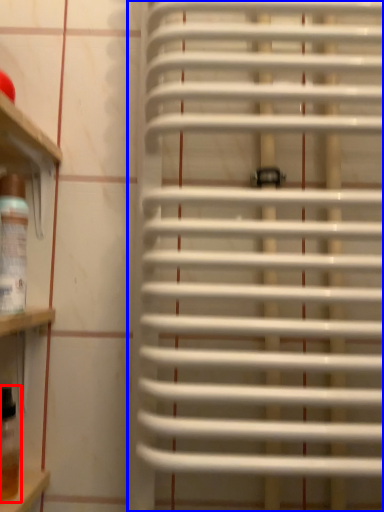
Question: Which object appears farthest to the camera in this image, wine bottle (highlighted by a red box) or window blind (highlighted by a blue box)?

Choices:
 (A) wine bottle
 (B) window blind

Answer: (A)